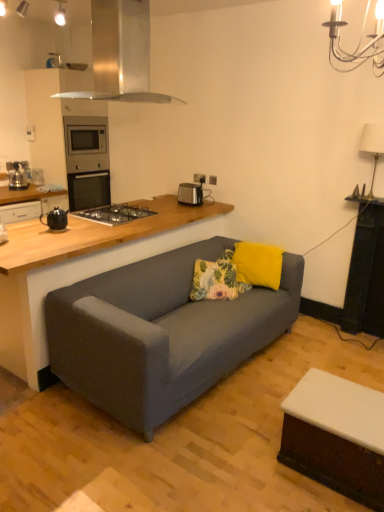
This screenshot has height=512, width=384. I want to click on empty space that is ontop of white glossy coffee table at lower right (from a real-world perspective), so click(345, 399).